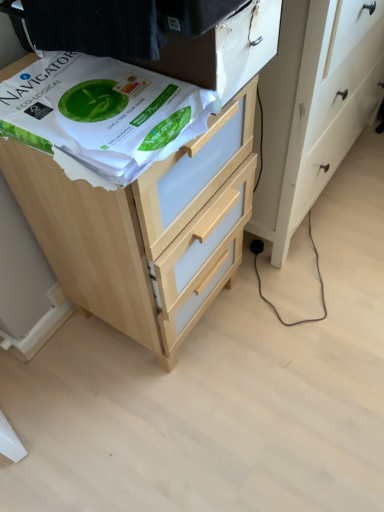
Identify the location of free space in front of light wood chest of drawers at upper center. (170, 419).